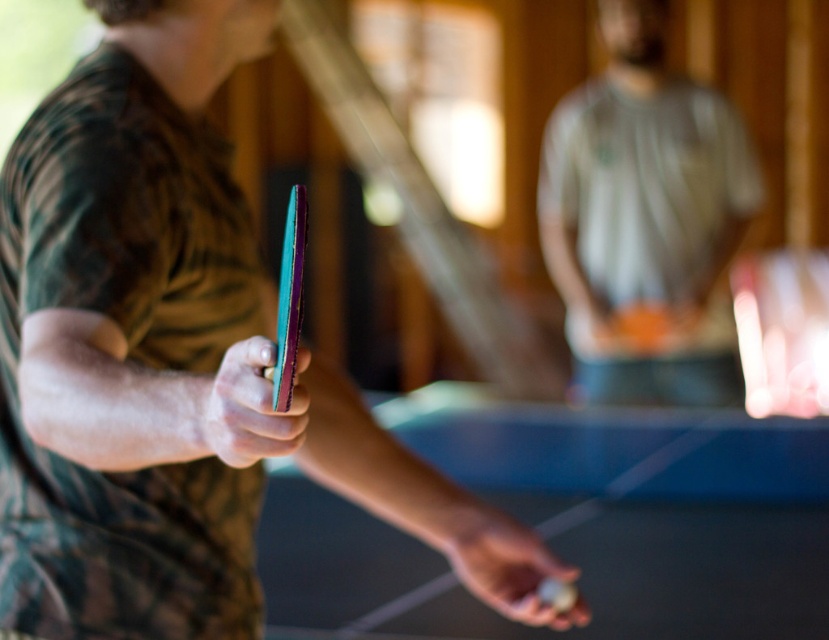
Looking at this image, between teal rubber paddle at center and multicolored wooden paddle at center, which one has less height?

Standing shorter between the two is multicolored wooden paddle at center.

Is teal rubber paddle at center thinner than multicolored wooden paddle at center?

In fact, teal rubber paddle at center might be wider than multicolored wooden paddle at center.

Image resolution: width=829 pixels, height=640 pixels. In order to click on teal rubber paddle at center in this screenshot , I will do `click(127, 337)`.

You are a GUI agent. You are given a task and a screenshot of the screen. Output one action in this format:
    pyautogui.click(x=<x>, y=<y>)
    Task: Click on the teal rubber paddle at center
    This screenshot has width=829, height=640.
    Given the screenshot: What is the action you would take?
    pyautogui.click(x=127, y=337)

Can you confirm if matte gray shirt at center is thinner than shiny metallic racket at center?

No.

Does matte gray shirt at center lie in front of shiny metallic racket at center?

No, matte gray shirt at center is behind shiny metallic racket at center.

Does point (589, 128) lie behind point (279, 372)?

Yes, point (589, 128) is farther from viewer.

Where is `matte gray shirt at center`? matte gray shirt at center is located at coordinates (645, 220).

Which is in front, point (81, 336) or point (590, 358)?

Point (81, 336) is more forward.

Which of these two, teal rubber paddle at center or matte gray shirt at center, stands taller?

Standing taller between the two is matte gray shirt at center.

Identify the location of teal rubber paddle at center. The image size is (829, 640). (127, 337).